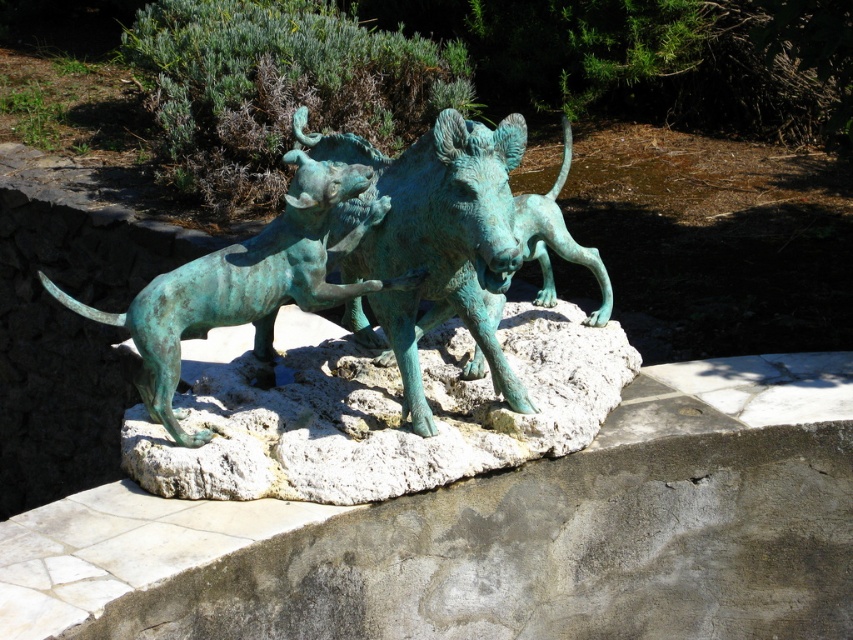
Question: Which point appears closest to the camera in this image?

Choices:
 (A) (172, 422)
 (B) (434, 301)

Answer: (A)

Question: Can you confirm if green patina rock at center is smaller than green patina bronze dog at left?

Choices:
 (A) no
 (B) yes

Answer: (A)

Question: Is green patina bronze boar at center to the left of green patina bronze dog at left from the viewer's perspective?

Choices:
 (A) no
 (B) yes

Answer: (A)

Question: Which point is closer to the camera taking this photo?

Choices:
 (A) (456, 148)
 (B) (302, 291)

Answer: (A)

Question: From the image, what is the correct spatial relationship of green patina rock at center in relation to green patina bronze dog at left?

Choices:
 (A) left
 (B) right

Answer: (B)

Question: Which object is closer to the camera taking this photo?

Choices:
 (A) green patina bronze boar at center
 (B) green patina bronze dog at left

Answer: (A)